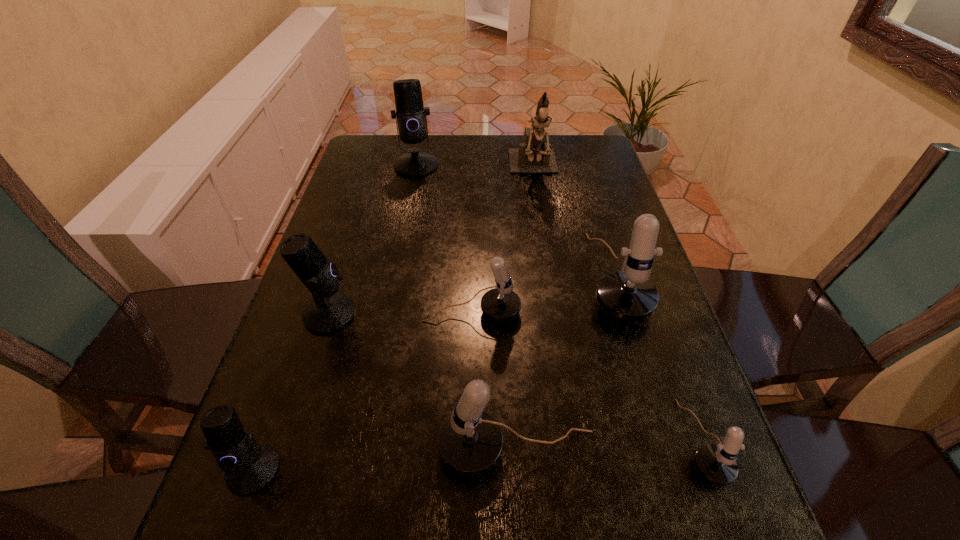
Identify which white microphone is the closest to the second smallest white microphone. Please provide its 2D coordinates. Your answer should be formatted as a tuple, i.e. [(x, y)], where the tuple contains the x and y coordinates of a point satisfying the conditions above.

[(628, 295)]

Find the location of a particular element. This screenshot has width=960, height=540. white microphone that stands as the second closest to the brown figurine is located at coordinates (501, 303).

This screenshot has height=540, width=960. What are the coordinates of `vacant space that satisfies the following two spatial constraints: 1. on the stand of the farthest microphone; 2. on the left side of the third smallest white microphone` in the screenshot? It's located at (361, 450).

This screenshot has width=960, height=540. I want to click on vacant region that satisfies the following two spatial constraints: 1. on the stand of the third smallest white microphone; 2. on the right side of the second farthest black microphone, so click(x=287, y=450).

I want to click on free space in the image that satisfies the following two spatial constraints: 1. on the front-facing side of the figurine; 2. on the stand of the second smallest black microphone, so click(x=557, y=314).

Find the location of a particular element. The height and width of the screenshot is (540, 960). vacant region that satisfies the following two spatial constraints: 1. on the stand of the farthest microphone; 2. on the left side of the shortest object is located at coordinates (363, 441).

The height and width of the screenshot is (540, 960). Find the location of `free space that satisfies the following two spatial constraints: 1. on the stand of the shortest object; 2. on the left side of the second smallest black microphone`. free space that satisfies the following two spatial constraints: 1. on the stand of the shortest object; 2. on the left side of the second smallest black microphone is located at coordinates (289, 441).